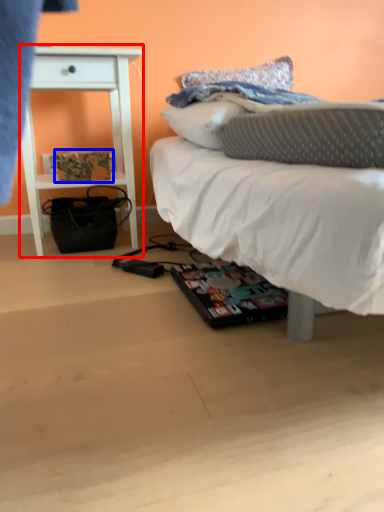
Question: Which of the following is the closest to the observer, nightstand (highlighted by a red box) or magazine (highlighted by a blue box)?

Choices:
 (A) nightstand
 (B) magazine

Answer: (A)